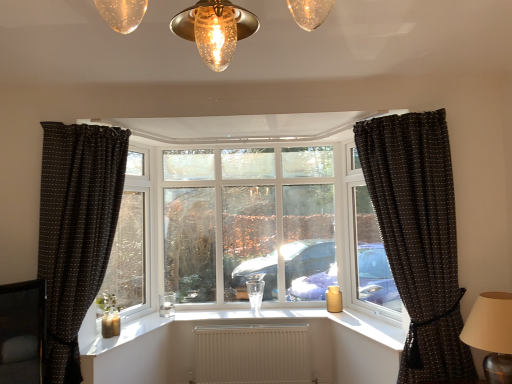
Question: Is clear glass window at right, the 2th window frame in the left-to-right sequence, situated inside clear glass window at left, which ranks as the first window frame in left-to-right order, or outside?

Choices:
 (A) outside
 (B) inside

Answer: (A)

Question: From a real-world perspective, is clear glass window at right, the 2th window frame in the left-to-right sequence, positioned above or below clear glass window at left, arranged as the 2th window frame when viewed from the right?

Choices:
 (A) above
 (B) below

Answer: (A)

Question: Which is nearer to the clear glass window at center?

Choices:
 (A) white textured radiator at center
 (B) matte silver candle holder at center
 (C) black dotted fabric curtain at right, the 2th curtain positioned from the left
 (D) clear glass window at left, arranged as the 2th window frame when viewed from the right
 (E) matte brown table lamp at right

Answer: (D)

Question: Which is farther from the clear glass window at right, the 2th window frame in the left-to-right sequence?

Choices:
 (A) matte silver candle holder at center
 (B) clear glass window at center
 (C) black dotted fabric curtain at right, which appears as the first curtain when viewed from the right
 (D) black dotted fabric curtain at left, the first curtain in the left-to-right sequence
 (E) matte brown table lamp at right

Answer: (D)